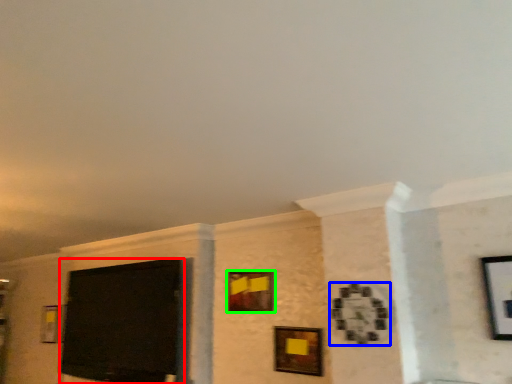
Question: Based on their relative distances, which object is farther from projection screen (highlighted by a red box)? Choose from picture frame (highlighted by a blue box) and picture frame (highlighted by a green box).

Choices:
 (A) picture frame
 (B) picture frame

Answer: (A)